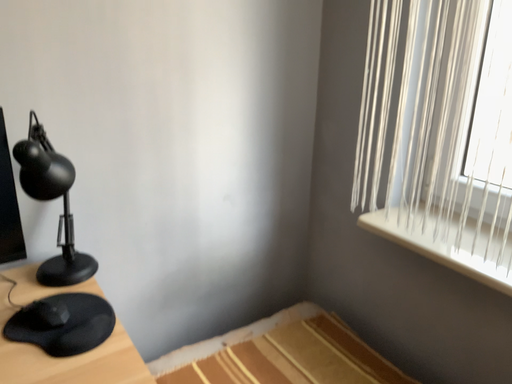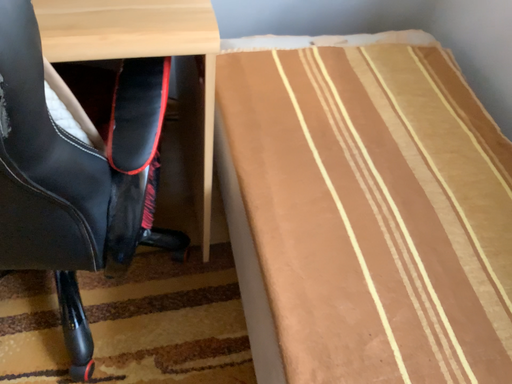
Question: Which way did the camera rotate in the video?

Choices:
 (A) rotated left
 (B) rotated right

Answer: (A)